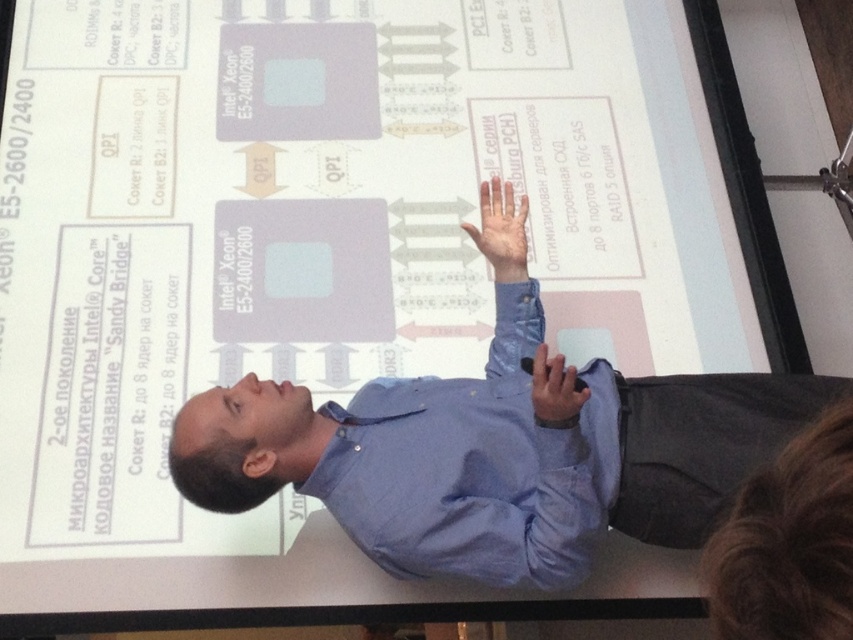
Which is above, blue shirt at center or light brown skin at upper center?

Positioned higher is light brown skin at upper center.

Between point (614, 433) and point (521, 248), which one is positioned in front?

Positioned in front is point (614, 433).

Does point (751, 442) lie in front of point (503, 243)?

Yes, it is in front of point (503, 243).

The image size is (853, 640). Find the location of `blue shirt at center`. blue shirt at center is located at coordinates (496, 456).

How much distance is there between light brown skin at upper center and matte blue shirt at center?

The distance of light brown skin at upper center from matte blue shirt at center is 36.75 centimeters.

Can you confirm if light brown skin at upper center is taller than matte blue shirt at center?

Correct, light brown skin at upper center is much taller as matte blue shirt at center.

Between point (477, 234) and point (543, 387), which one is positioned behind?

The point (477, 234) is more distant.

Where is `light brown skin at upper center`? Image resolution: width=853 pixels, height=640 pixels. light brown skin at upper center is located at coordinates (502, 230).

Does point (494, 572) come in front of point (561, 406)?

No.

What do you see at coordinates (496, 456) in the screenshot? I see `blue shirt at center` at bounding box center [496, 456].

Where is `blue shirt at center`? The height and width of the screenshot is (640, 853). blue shirt at center is located at coordinates (496, 456).